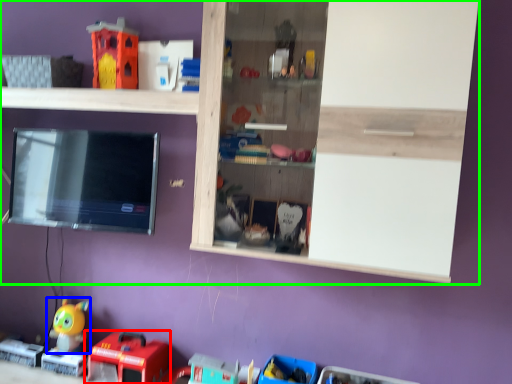
Question: Based on their relative distances, which object is farther from toy (highlighted by a red box)? Choose from toy (highlighted by a blue box) and shelf (highlighted by a green box).

Choices:
 (A) toy
 (B) shelf

Answer: (B)